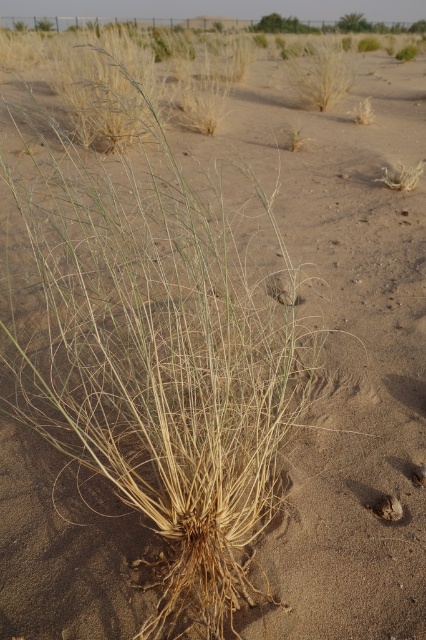
Is point (342, 77) more distant than point (400, 164)?

Yes, it is.

At what (x,y) coordinates should I click in order to perform the action: click on dry grass at upper center. Please return your answer as a coordinate pair (x, y). Looking at the image, I should click on tap(319, 72).

Does dry grass at upper center appear on the left side of dry grass at center?

In fact, dry grass at upper center is to the right of dry grass at center.

Which of these two, dry grass at upper center or dry grass at center, stands taller?

dry grass at upper center

Between point (307, 83) and point (370, 108), which one is positioned behind?

Point (307, 83)

This screenshot has height=640, width=426. In order to click on dry grass at upper center in this screenshot , I will do `click(319, 72)`.

Who is more forward, (403, 173) or (359, 109)?

Point (403, 173)

Is point (402, 173) closer to viewer compared to point (368, 112)?

Yes, it is.

The height and width of the screenshot is (640, 426). I want to click on dry straw-like plant at upper right, so pyautogui.click(x=400, y=177).